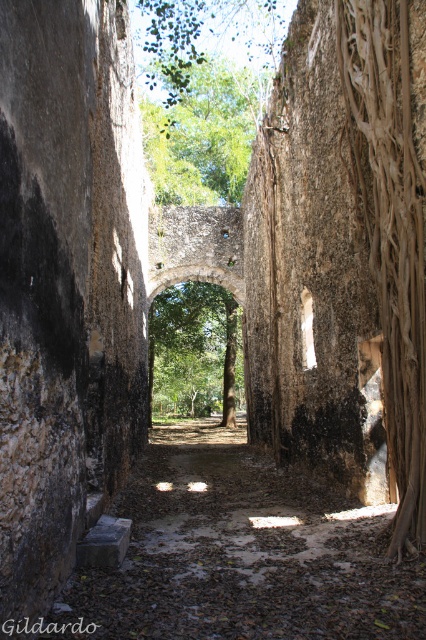
You are standing at the entrance of the corridor and want to walk through the green leafy archway at center. Which direction should you move relative to the green leafy tree at upper center to reach the archway?

The green leafy tree at upper center is located above the green leafy archway at center. To reach the archway, you should move forward towards the corridor, as the archway is in front of the tree and aligned below it.

You are an explorer trying to pass through the corridor. You notice the brown rough tree root at right and the green leafy archway at center. Which of these two objects is narrower in width?

The brown rough tree root at right is narrower in width than the green leafy archway at center.

You are a hiker who has just entered the ancient stone corridor. You notice the brown rough tree root at right and the green leafy archway at center. Which object would you encounter first as you walk straight ahead?

The brown rough tree root at right is closer to the viewer than the green leafy archway at center, so you would encounter the brown rough tree root at right first.